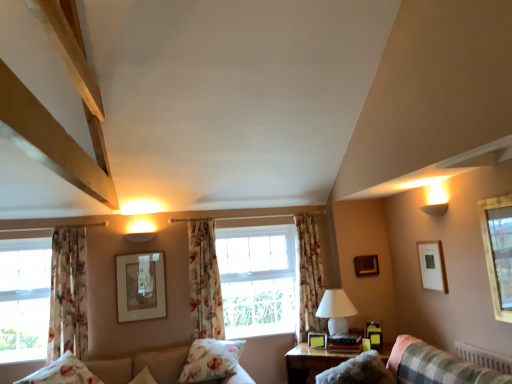
The width and height of the screenshot is (512, 384). In order to click on vacant area that lies to the right of matte gold picture frame at lower center, which is the 3th picture frame from front to back in this screenshot , I will do `click(337, 345)`.